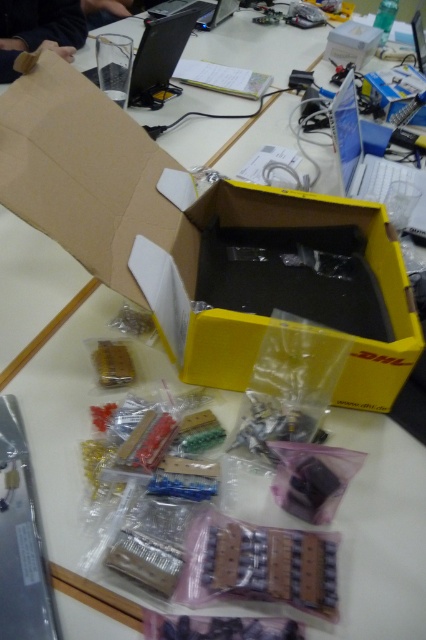
Question: Among these objects, which one is nearest to the camera?

Choices:
 (A) yellow cardboard box at center
 (B) black plastic laptop at upper center
 (C) yellow matte box at center
 (D) glossy black laptop at upper center

Answer: (A)

Question: Is yellow cardboard box at center positioned behind black plastic laptop at upper center?

Choices:
 (A) yes
 (B) no

Answer: (B)

Question: Which point is closer to the camera?

Choices:
 (A) (183, 29)
 (B) (68, 166)

Answer: (B)

Question: Can you confirm if yellow cardboard box at center is positioned to the left of silver metallic laptop at upper right?

Choices:
 (A) yes
 (B) no

Answer: (A)

Question: Is black plastic laptop at upper center bigger than yellow matte box at center?

Choices:
 (A) yes
 (B) no

Answer: (A)

Question: Which point is farther to the camera?

Choices:
 (A) (137, 93)
 (B) (371, 26)
 (C) (417, 220)

Answer: (B)